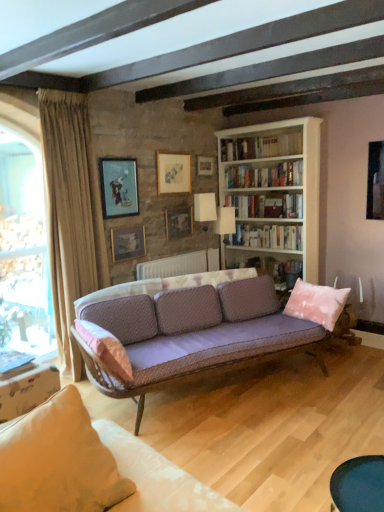
Question: Does white paper bookshelf at upper center, which is counted as the 2th book, starting from the bottom, have a greater height compared to hardcover book at lower left, which is counted as the fifth book, starting from the top?

Choices:
 (A) yes
 (B) no

Answer: (A)

Question: From the image's perspective, does white paper bookshelf at upper center, which appears as the 4th book when viewed from the top, appear lower than hardcover book at lower left, which is the first book in bottom-to-top order?

Choices:
 (A) yes
 (B) no

Answer: (B)

Question: From a real-world perspective, is white paper bookshelf at upper center, which appears as the 4th book when viewed from the top, on hardcover book at lower left, which is counted as the fifth book, starting from the top?

Choices:
 (A) yes
 (B) no

Answer: (A)

Question: Does white paper bookshelf at upper center, which is counted as the 2th book, starting from the bottom, lie behind hardcover book at lower left, which is counted as the fifth book, starting from the top?

Choices:
 (A) yes
 (B) no

Answer: (A)

Question: Would you say white paper bookshelf at upper center, which appears as the 4th book when viewed from the top, contains hardcover book at lower left, which is counted as the fifth book, starting from the top?

Choices:
 (A) yes
 (B) no

Answer: (B)

Question: From a real-world perspective, is white paper bookshelf at upper center, which appears as the 4th book when viewed from the top, above or below matte blue painting at upper left, the 1th picture frame viewed from the left?

Choices:
 (A) above
 (B) below

Answer: (B)

Question: From the image's perspective, is white paper bookshelf at upper center, which is counted as the 2th book, starting from the bottom, located above or below matte blue painting at upper left, positioned as the 5th picture frame in right-to-left order?

Choices:
 (A) below
 (B) above

Answer: (A)

Question: Based on their sizes in the image, would you say white paper bookshelf at upper center, which appears as the 4th book when viewed from the top, is bigger or smaller than matte blue painting at upper left, the 1th picture frame viewed from the left?

Choices:
 (A) small
 (B) big

Answer: (B)

Question: Based on their positions, is white paper bookshelf at upper center, which is counted as the 2th book, starting from the bottom, located to the left or right of matte blue painting at upper left, the 1th picture frame viewed from the left?

Choices:
 (A) left
 (B) right

Answer: (B)

Question: Does point (264, 136) appear closer or farther from the camera than point (142, 242)?

Choices:
 (A) closer
 (B) farther

Answer: (B)

Question: Looking at the image, does white glossy bookshelf at upper center, marked as the first book in a top-to-bottom arrangement, seem bigger or smaller compared to matte gold picture frame at center, which is the 2th picture frame from left to right?

Choices:
 (A) big
 (B) small

Answer: (A)

Question: In the image, is white glossy bookshelf at upper center, marked as the first book in a top-to-bottom arrangement, positioned in front of or behind matte gold picture frame at center, which is the 2th picture frame from left to right?

Choices:
 (A) front
 (B) behind

Answer: (B)

Question: In the image, is white glossy bookshelf at upper center, the 5th book when ordered from bottom to top, on the left side or the right side of matte gold picture frame at center, placed as the 4th picture frame when sorted from right to left?

Choices:
 (A) right
 (B) left

Answer: (A)

Question: From the image's perspective, is pink velvet pillow at right, positioned as the second pillow in left-to-right order, positioned above or below white glossy bookshelf at upper center, marked as the first book in a top-to-bottom arrangement?

Choices:
 (A) above
 (B) below

Answer: (B)

Question: Considering their positions, is pink velvet pillow at right, the second pillow positioned from the front, located in front of or behind white glossy bookshelf at upper center, the 5th book when ordered from bottom to top?

Choices:
 (A) front
 (B) behind

Answer: (A)